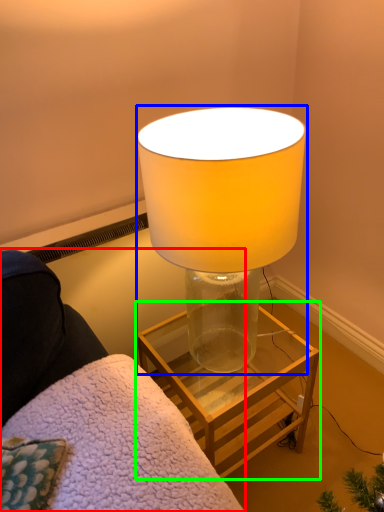
Question: Which object is the farthest from furniture (highlighted by a red box)? Choose among these: lamp (highlighted by a blue box) or table (highlighted by a green box).

Choices:
 (A) lamp
 (B) table

Answer: (B)